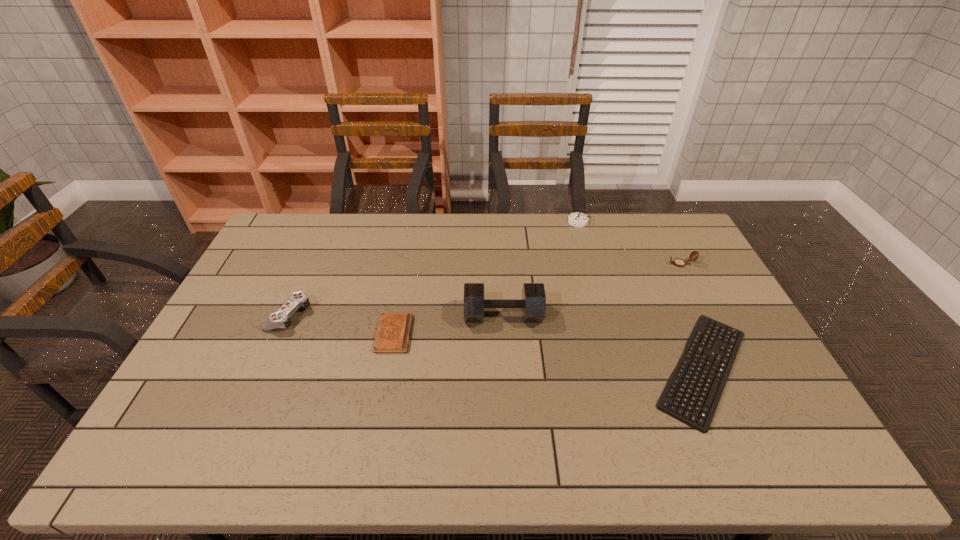
This screenshot has height=540, width=960. Find the location of `vacant position located on the right of the left compass`. vacant position located on the right of the left compass is located at coordinates (614, 222).

The image size is (960, 540). Find the location of `free space located on the right of the leftmost object`. free space located on the right of the leftmost object is located at coordinates (365, 315).

At what (x,y) coordinates should I click in order to perform the action: click on free location located 0.340m on the face of the right compass. Please return your answer as a coordinate pair (x, y). This screenshot has height=540, width=960. Looking at the image, I should click on (570, 264).

Locate an element on the screen. This screenshot has width=960, height=540. vacant space located on the face of the right compass is located at coordinates (642, 264).

Image resolution: width=960 pixels, height=540 pixels. Find the location of `vacant space positioned on the face of the right compass`. vacant space positioned on the face of the right compass is located at coordinates (636, 264).

Locate an element on the screen. This screenshot has width=960, height=540. vacant point located 0.190m on the spine side of the diary is located at coordinates (474, 334).

Find the location of `vacant region located on the left of the computer keyboard`. vacant region located on the left of the computer keyboard is located at coordinates (608, 368).

You are a GUI agent. You are given a task and a screenshot of the screen. Output one action in this format:
    pyautogui.click(x=<x>, y=<y>)
    Task: Click on the object located at the far edge
    Image resolution: width=960 pixels, height=540 pixels.
    Given the screenshot: What is the action you would take?
    pyautogui.click(x=577, y=219)

This screenshot has height=540, width=960. Find the location of `object located at the near edge`. object located at the near edge is located at coordinates [667, 396].

Locate an element on the screen. This screenshot has height=540, width=960. object located in the left edge section of the desktop is located at coordinates (279, 319).